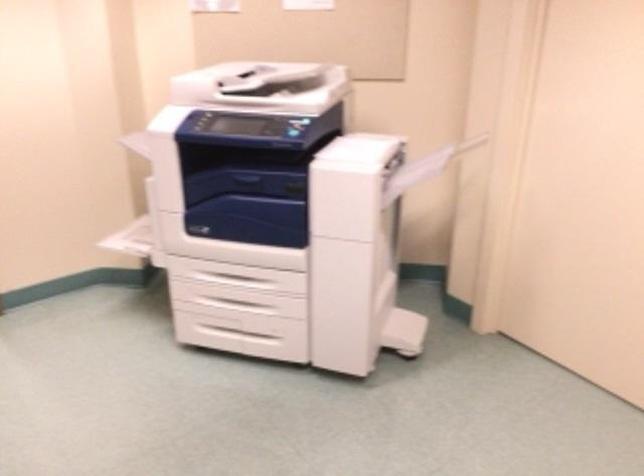
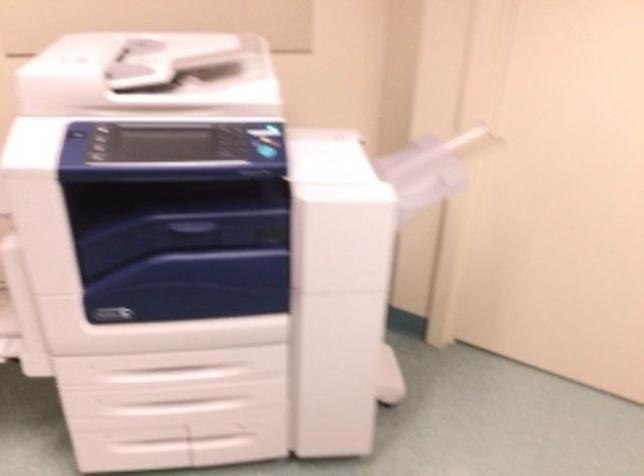
The point at (237, 283) is marked in the first image. Where is the corresponding point in the second image?

(176, 373)